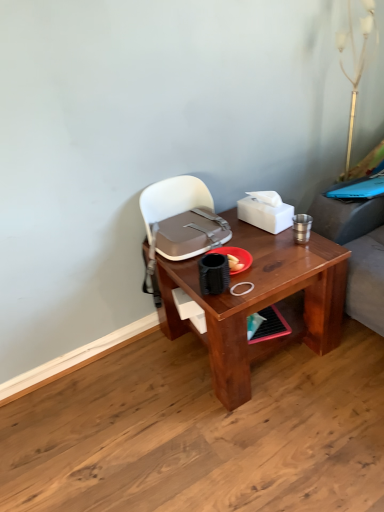
Question: Can you confirm if gold metallic table lamp at upper right is taller than matte gray handbag at center?

Choices:
 (A) yes
 (B) no

Answer: (A)

Question: Is gold metallic table lamp at upper right positioned in front of matte gray handbag at center?

Choices:
 (A) yes
 (B) no

Answer: (B)

Question: Is gold metallic table lamp at upper right oriented towards matte gray handbag at center?

Choices:
 (A) yes
 (B) no

Answer: (B)

Question: From a real-world perspective, does gold metallic table lamp at upper right stand above matte gray handbag at center?

Choices:
 (A) yes
 (B) no

Answer: (A)

Question: Is gold metallic table lamp at upper right bigger than matte gray handbag at center?

Choices:
 (A) yes
 (B) no

Answer: (B)

Question: From a real-world perspective, relative to gold metallic table lamp at upper right, is matte gray handbag at center vertically above or below?

Choices:
 (A) above
 (B) below

Answer: (B)

Question: Considering the positions of matte gray handbag at center and gold metallic table lamp at upper right in the image, is matte gray handbag at center bigger or smaller than gold metallic table lamp at upper right?

Choices:
 (A) small
 (B) big

Answer: (B)

Question: Based on their positions, is matte gray handbag at center located to the left or right of gold metallic table lamp at upper right?

Choices:
 (A) right
 (B) left

Answer: (B)

Question: Considering their positions, is matte gray handbag at center located in front of or behind gold metallic table lamp at upper right?

Choices:
 (A) front
 (B) behind

Answer: (A)

Question: Does point (180, 279) appear closer or farther from the camera than point (251, 202)?

Choices:
 (A) farther
 (B) closer

Answer: (B)

Question: From their relative heights in the image, would you say brown wooden desk at center is taller or shorter than white matte tissue box at upper right?

Choices:
 (A) tall
 (B) short

Answer: (A)

Question: Do you think brown wooden desk at center is within white matte tissue box at upper right, or outside of it?

Choices:
 (A) outside
 (B) inside

Answer: (A)

Question: In the image, is brown wooden desk at center positioned in front of or behind white matte tissue box at upper right?

Choices:
 (A) front
 (B) behind

Answer: (A)

Question: Relative to brown wooden desk at center, is gold metallic table lamp at upper right in front or behind?

Choices:
 (A) behind
 (B) front

Answer: (A)

Question: Is point (357, 42) closer or farther from the camera than point (183, 282)?

Choices:
 (A) closer
 (B) farther

Answer: (B)